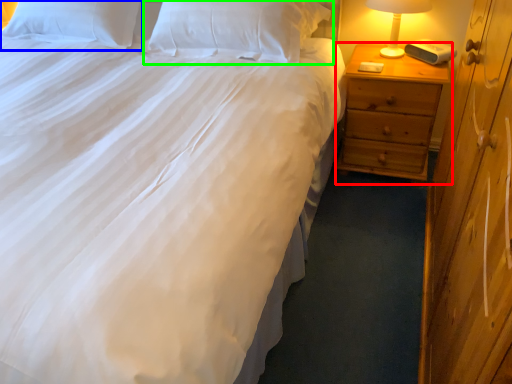
Question: Based on their relative distances, which object is farther from nightstand (highlighted by a red box)? Choose from pillow (highlighted by a blue box) and pillow (highlighted by a green box).

Choices:
 (A) pillow
 (B) pillow

Answer: (A)